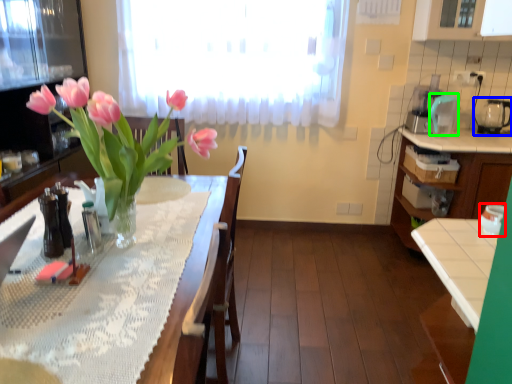
Question: Considering the real-world distances, which object is farthest from appliance (highlighted by a red box)? appliance (highlighted by a blue box) or appliance (highlighted by a green box)?

Choices:
 (A) appliance
 (B) appliance

Answer: (A)